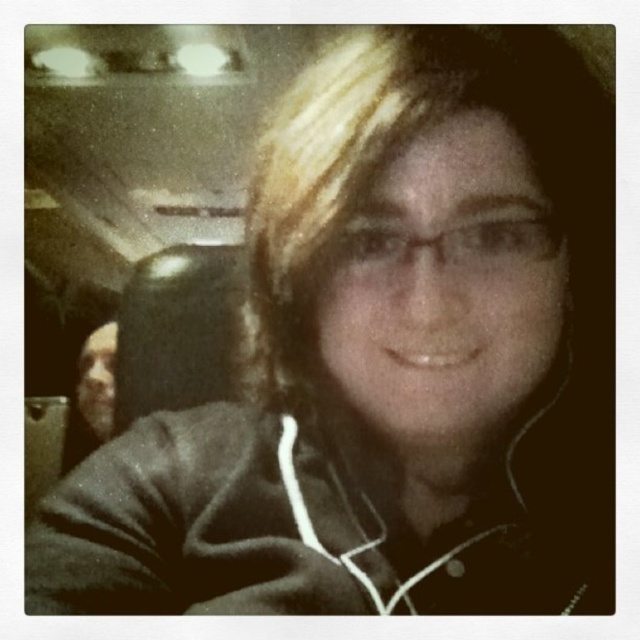
Does point (435, 77) come in front of point (108, 403)?

Yes, it is in front of point (108, 403).

Between blondehair at center and smooth skin face at left, which one is positioned higher?

blondehair at center

Is point (376, 42) closer to camera compared to point (76, 413)?

That is True.

Where is `blondehair at center`? The height and width of the screenshot is (640, 640). blondehair at center is located at coordinates (392, 154).